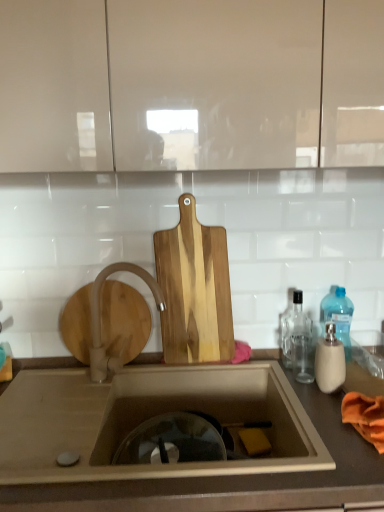
Where is `free spot to the right of beige matte soap dispenser at right, marked as the third bottle in a back-to-front arrangement`? This screenshot has width=384, height=512. free spot to the right of beige matte soap dispenser at right, marked as the third bottle in a back-to-front arrangement is located at coordinates tap(360, 383).